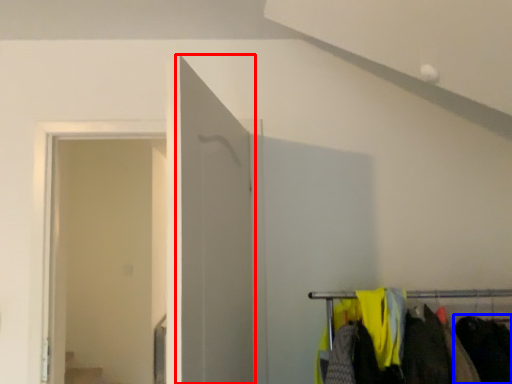
Question: Which object appears closest to the camera in this image, door (highlighted by a red box) or clothing (highlighted by a blue box)?

Choices:
 (A) door
 (B) clothing

Answer: (A)